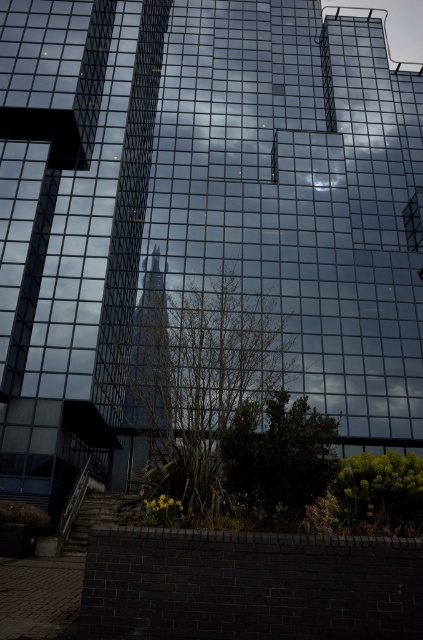
You are a landscape architect designing a garden around the modern glass building. You need to place a new statue that requires a large, open space. Which object between the green leafy tree at center and the green leafy bush at lower right would you consider moving to accommodate the statue?

The green leafy tree at center is larger in size than the green leafy bush at lower right, so moving the smaller green leafy bush at lower right would be more feasible to create space for the statue.

You are a landscape architect planning to place a new statue in the garden. The statue requires a space wider than the green leafy tree at lower center but narrower than the green leafy bush at lower right. Can you determine if there is a suitable spot between them for the statue?

The green leafy tree at lower center is narrower than the green leafy bush at lower right. Since the statue needs a space wider than the tree but narrower than the bush, there might be a suitable spot between them if the available space allows for a width between the two measurements.